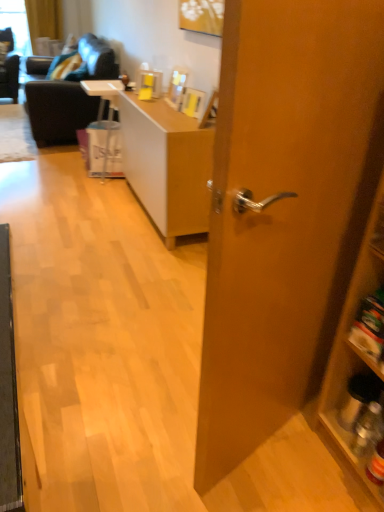
Question: From a real-world perspective, is white plastic bag at center on dark gray fabric couch at upper left?

Choices:
 (A) no
 (B) yes

Answer: (A)

Question: From the image's perspective, is white plastic bag at center beneath dark gray fabric couch at upper left?

Choices:
 (A) yes
 (B) no

Answer: (A)

Question: Does white plastic bag at center have a greater width compared to dark gray fabric couch at upper left?

Choices:
 (A) no
 (B) yes

Answer: (A)

Question: Considering the relative positions of white plastic bag at center and dark gray fabric couch at upper left in the image provided, is white plastic bag at center to the left of dark gray fabric couch at upper left from the viewer's perspective?

Choices:
 (A) no
 (B) yes

Answer: (A)

Question: Is white plastic bag at center aimed at dark gray fabric couch at upper left?

Choices:
 (A) yes
 (B) no

Answer: (B)

Question: Based on their positions, is light brown wood desk at center located to the left or right of wooden door at center?

Choices:
 (A) left
 (B) right

Answer: (A)

Question: Which is correct: light brown wood desk at center is inside wooden door at center, or outside of it?

Choices:
 (A) outside
 (B) inside

Answer: (A)

Question: Considering the positions of light brown wood desk at center and wooden door at center in the image, is light brown wood desk at center wider or thinner than wooden door at center?

Choices:
 (A) wide
 (B) thin

Answer: (A)

Question: Considering the positions of light brown wood desk at center and wooden door at center in the image, is light brown wood desk at center bigger or smaller than wooden door at center?

Choices:
 (A) big
 (B) small

Answer: (A)

Question: Based on their sizes in the image, would you say wooden door at center is bigger or smaller than dark gray fabric couch at upper left?

Choices:
 (A) big
 (B) small

Answer: (B)

Question: Is point (279, 259) closer or farther from the camera than point (57, 91)?

Choices:
 (A) farther
 (B) closer

Answer: (B)

Question: From a real-world perspective, is wooden door at center physically located above or below dark gray fabric couch at upper left?

Choices:
 (A) below
 (B) above

Answer: (B)

Question: Which is correct: wooden door at center is inside dark gray fabric couch at upper left, or outside of it?

Choices:
 (A) outside
 (B) inside

Answer: (A)

Question: Which is correct: white plastic bag at center is inside velvet green pillow at upper left, or outside of it?

Choices:
 (A) outside
 (B) inside

Answer: (A)

Question: From a real-world perspective, is white plastic bag at center positioned above or below velvet green pillow at upper left?

Choices:
 (A) above
 (B) below

Answer: (B)